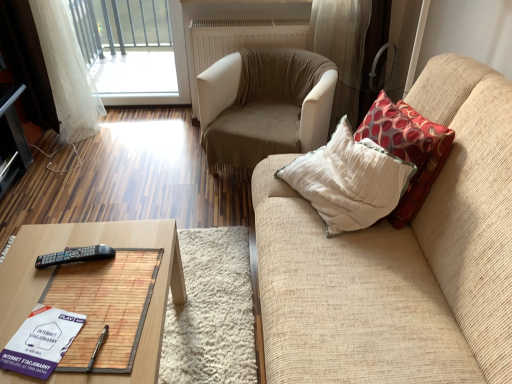
I want to click on free space above purple paper book at lower left (from a real-world perspective), so click(38, 340).